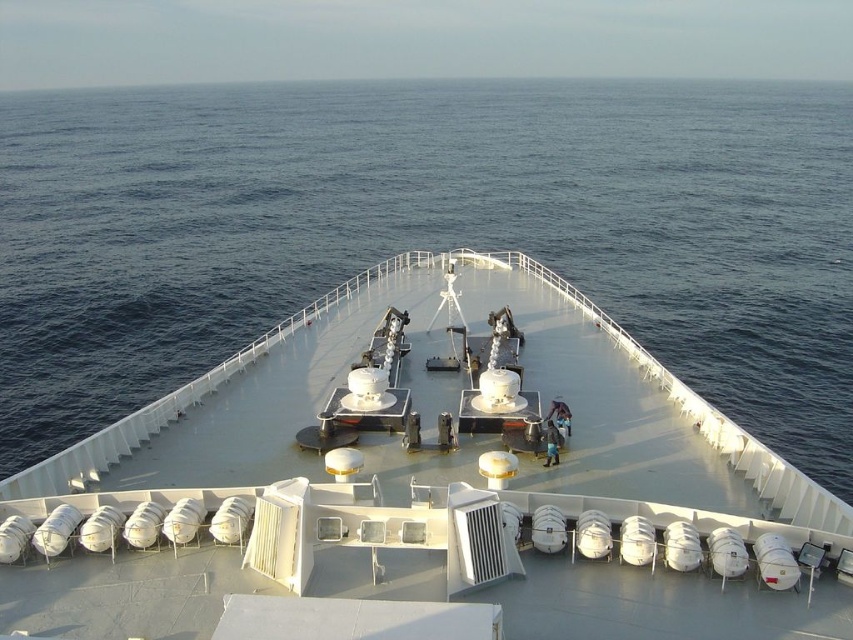
Question: Does white matte boat at center have a smaller size compared to blue water at center?

Choices:
 (A) yes
 (B) no

Answer: (A)

Question: Which point appears farthest from the camera in this image?

Choices:
 (A) (776, 209)
 (B) (306, 368)

Answer: (A)

Question: Which object appears closest to the camera in this image?

Choices:
 (A) blue water at center
 (B) white matte boat at center

Answer: (B)

Question: Can you confirm if white matte boat at center is positioned above blue water at center?

Choices:
 (A) yes
 (B) no

Answer: (B)

Question: Observing the image, what is the correct spatial positioning of white matte boat at center in reference to blue water at center?

Choices:
 (A) below
 (B) above

Answer: (A)